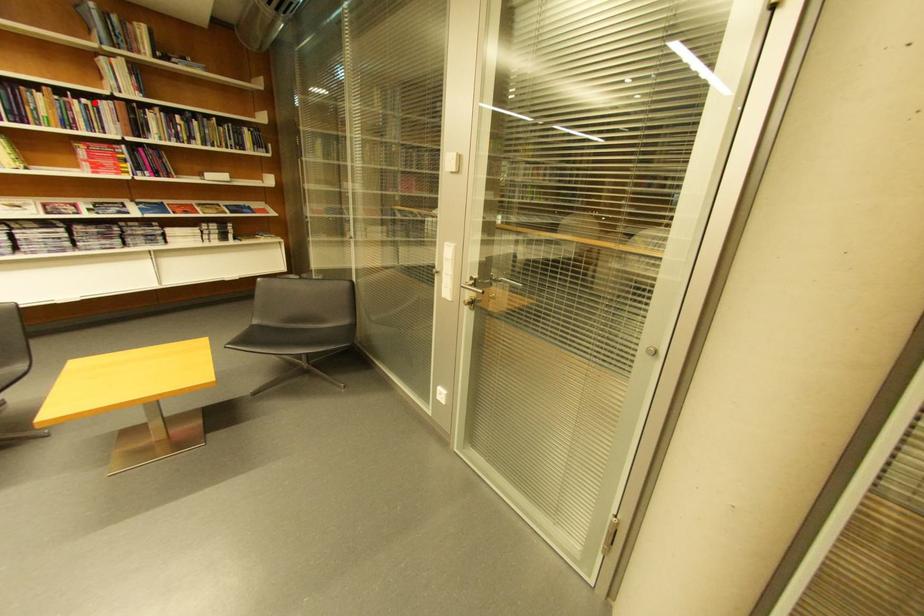
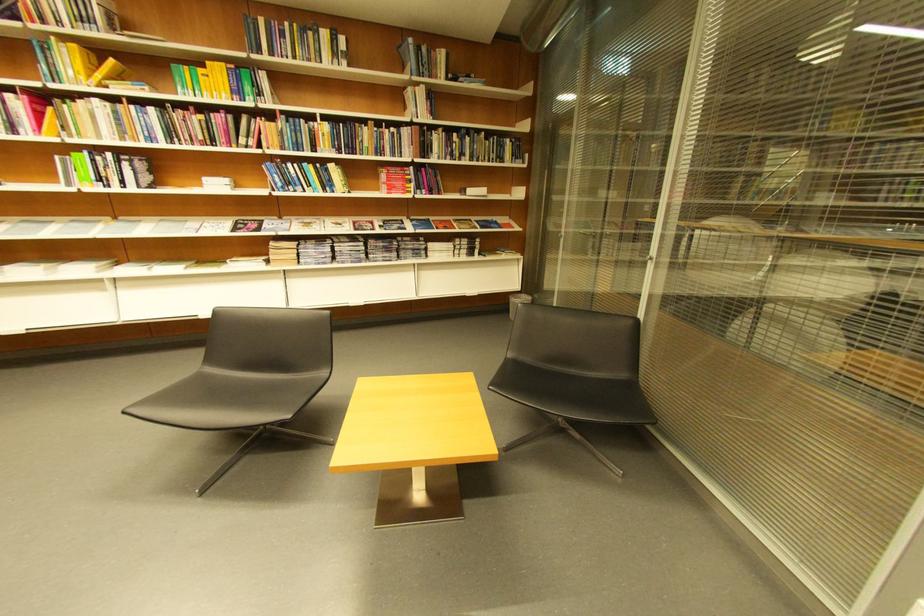
Question: I am providing you with two images of the same scene from different viewpoints. Image1 has a red point marked. In image2, the corresponding 3D location appears at what relative position? Reply with the corresponding letter.

Choices:
 (A) Closer
 (B) Farther

Answer: (A)